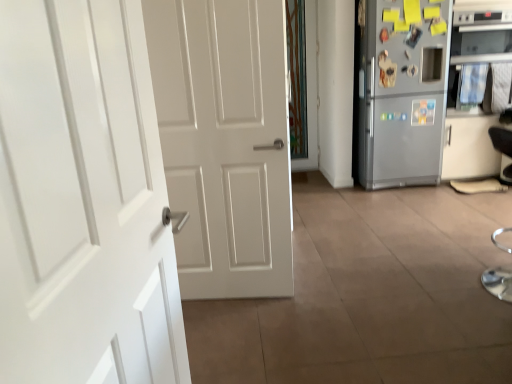
Question: In terms of width, does black leather armchair at right look wider or thinner when compared to silver metallic oven at right?

Choices:
 (A) thin
 (B) wide

Answer: (A)

Question: From the image's perspective, relative to silver metallic oven at right, is black leather armchair at right above or below?

Choices:
 (A) below
 (B) above

Answer: (A)

Question: Which object is the closest to the black leather armchair at right?

Choices:
 (A) silver metallic refrigerator at right
 (B) white glossy door at left
 (C) silver metallic oven at right

Answer: (C)

Question: Considering the real-world distances, which object is closest to the white glossy door at left?

Choices:
 (A) silver metallic refrigerator at right
 (B) silver metallic oven at right
 (C) black leather armchair at right

Answer: (A)